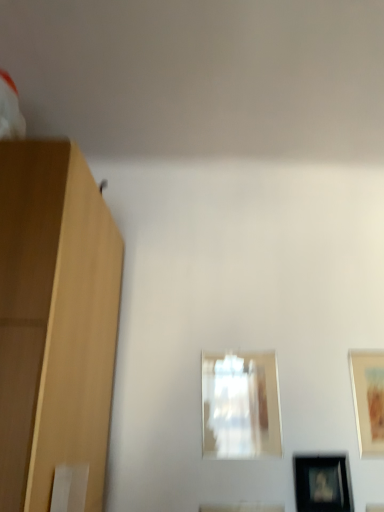
Question: From the image's perspective, does black glossy picture frame at lower right, positioned as the second picture frame in right-to-left order, appear lower than matte wooden picture frame at right, placed as the 3th picture frame when sorted from left to right?

Choices:
 (A) no
 (B) yes

Answer: (B)

Question: Can you see black glossy picture frame at lower right, positioned as the second picture frame in right-to-left order, touching matte wooden picture frame at right, which ranks as the 1th picture frame in right-to-left order?

Choices:
 (A) yes
 (B) no

Answer: (B)

Question: Is black glossy picture frame at lower right, the 2th picture frame when ordered from left to right, thinner than matte wooden picture frame at right, placed as the 3th picture frame when sorted from left to right?

Choices:
 (A) no
 (B) yes

Answer: (A)

Question: Is black glossy picture frame at lower right, positioned as the second picture frame in right-to-left order, to the left of matte wooden picture frame at right, which ranks as the 1th picture frame in right-to-left order, from the viewer's perspective?

Choices:
 (A) no
 (B) yes

Answer: (B)

Question: Could matte wooden picture frame at right, placed as the 3th picture frame when sorted from left to right, be considered to be inside black glossy picture frame at lower right, the 2th picture frame when ordered from left to right?

Choices:
 (A) yes
 (B) no

Answer: (B)

Question: From a real-world perspective, is matte wooden picture frame at right, placed as the 3th picture frame when sorted from left to right, physically located above or below transparent glass picture frame at center, the 1th picture frame positioned from the left?

Choices:
 (A) below
 (B) above

Answer: (B)

Question: Considering their positions, is matte wooden picture frame at right, placed as the 3th picture frame when sorted from left to right, located in front of or behind transparent glass picture frame at center, which is the 3th picture frame from right to left?

Choices:
 (A) front
 (B) behind

Answer: (A)

Question: In the image, is matte wooden picture frame at right, placed as the 3th picture frame when sorted from left to right, on the left side or the right side of transparent glass picture frame at center, the 1th picture frame positioned from the left?

Choices:
 (A) left
 (B) right

Answer: (B)

Question: Is matte wooden picture frame at right, placed as the 3th picture frame when sorted from left to right, bigger or smaller than transparent glass picture frame at center, which is the 3th picture frame from right to left?

Choices:
 (A) big
 (B) small

Answer: (B)

Question: Is point (360, 362) positioned closer to the camera than point (344, 456)?

Choices:
 (A) closer
 (B) farther

Answer: (B)

Question: Is matte wooden picture frame at right, placed as the 3th picture frame when sorted from left to right, to the left or to the right of black glossy picture frame at lower right, positioned as the second picture frame in right-to-left order, in the image?

Choices:
 (A) left
 (B) right

Answer: (B)

Question: From a real-world perspective, is matte wooden picture frame at right, which ranks as the 1th picture frame in right-to-left order, positioned above or below black glossy picture frame at lower right, the 2th picture frame when ordered from left to right?

Choices:
 (A) above
 (B) below

Answer: (A)

Question: Considering the positions of matte wooden picture frame at right, placed as the 3th picture frame when sorted from left to right, and black glossy picture frame at lower right, positioned as the second picture frame in right-to-left order, in the image, is matte wooden picture frame at right, placed as the 3th picture frame when sorted from left to right, taller or shorter than black glossy picture frame at lower right, positioned as the second picture frame in right-to-left order,?

Choices:
 (A) tall
 (B) short

Answer: (A)

Question: Considering their positions, is black glossy picture frame at lower right, positioned as the second picture frame in right-to-left order, located in front of or behind matte wooden picture frame at right, which ranks as the 1th picture frame in right-to-left order?

Choices:
 (A) front
 (B) behind

Answer: (A)

Question: Considering the positions of black glossy picture frame at lower right, positioned as the second picture frame in right-to-left order, and matte wooden picture frame at right, placed as the 3th picture frame when sorted from left to right, in the image, is black glossy picture frame at lower right, positioned as the second picture frame in right-to-left order, wider or thinner than matte wooden picture frame at right, placed as the 3th picture frame when sorted from left to right,?

Choices:
 (A) thin
 (B) wide

Answer: (B)